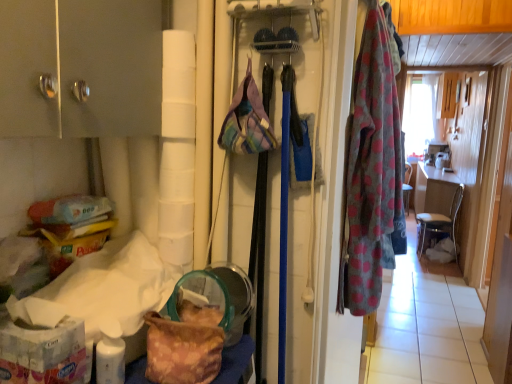
Question: Considering the positions of metallic silver chair at right and polka dot fabric robe at right in the image, is metallic silver chair at right wider or thinner than polka dot fabric robe at right?

Choices:
 (A) wide
 (B) thin

Answer: (A)

Question: Is metallic silver chair at right bigger or smaller than polka dot fabric robe at right?

Choices:
 (A) big
 (B) small

Answer: (A)

Question: Which of these objects is positioned closest to the plaid fabric handbag at center, which is the second handbag in bottom-to-top order?

Choices:
 (A) matte silver cabinet at upper left
 (B) camouflage fabric bag at lower left, positioned as the 2th handbag in top-to-bottom order
 (C) white matte toilet paper at center
 (D) polka dot fabric robe at right
 (E) metallic silver chair at right

Answer: (C)

Question: Which object is the closest to the polka dot fabric robe at right?

Choices:
 (A) plaid fabric handbag at center, the 1th handbag from the top
 (B) matte silver cabinet at upper left
 (C) camouflage fabric bag at lower left, positioned as the 2th handbag in top-to-bottom order
 (D) white matte toilet paper at center
 (E) metallic silver chair at right

Answer: (A)